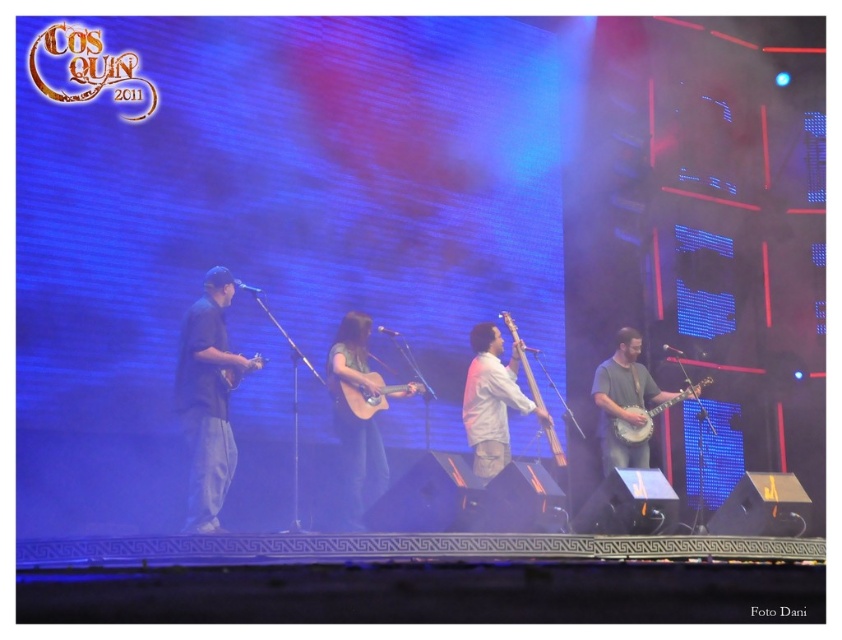
You are a stagehand who needs to adjust the lighting for the two guitars on stage. The matte wood guitar at center and the wooden acoustic guitar at center. Which guitar is closer to the ground?

The matte wood guitar at center is positioned under the wooden acoustic guitar at center, so it is closer to the ground.

You are a stagehand who needs to place a protective cover over the matte brown banjo at center and the light brown acoustic guitar at center. Which instrument requires a larger cover?

The matte brown banjo at center requires a larger cover because it has a larger size compared to the light brown acoustic guitar at center.

You are a stagehand setting up microphones for the dark gray fabric guitar at left and the white matte cello at center. Which instrument should you place a taller microphone stand for?

The dark gray fabric guitar at left requires a taller microphone stand because it has a greater height compared to the white matte cello at center.